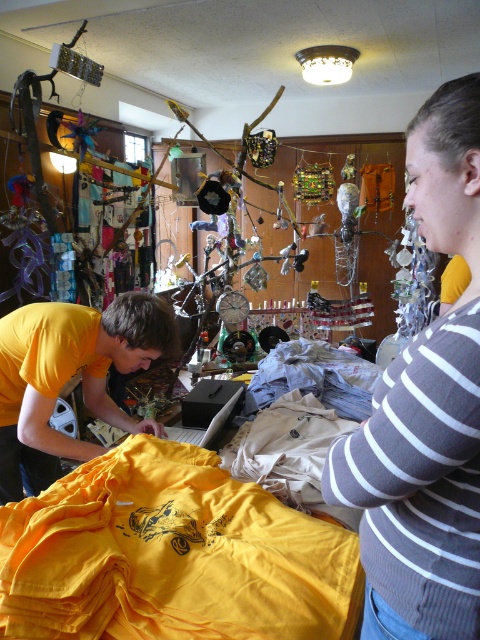
Question: Considering the real-world distances, which object is closest to the gray striped sweater at upper right?

Choices:
 (A) yellow matte shirt at left
 (B) yellow matte t-shirt at lower left

Answer: (B)

Question: Is gray striped sweater at upper right wider than yellow matte shirt at left?

Choices:
 (A) yes
 (B) no

Answer: (B)

Question: Based on their relative distances, which object is farther from the yellow matte t-shirt at lower left?

Choices:
 (A) yellow matte shirt at left
 (B) gray striped sweater at upper right

Answer: (B)

Question: Which point appears farthest from the camera in this image?

Choices:
 (A) (128, 422)
 (B) (441, 189)
 (C) (133, 484)

Answer: (A)

Question: Can you confirm if gray striped sweater at upper right is bigger than yellow matte shirt at left?

Choices:
 (A) yes
 (B) no

Answer: (B)

Question: Can you confirm if yellow matte t-shirt at lower left is positioned above gray striped sweater at upper right?

Choices:
 (A) yes
 (B) no

Answer: (B)